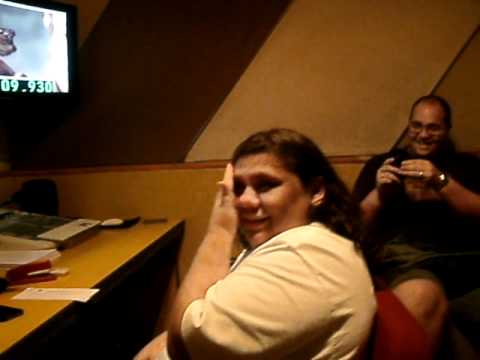
Locate an element on the screen. paper closest to the front of the woman on the desk is located at coordinates (62, 295).